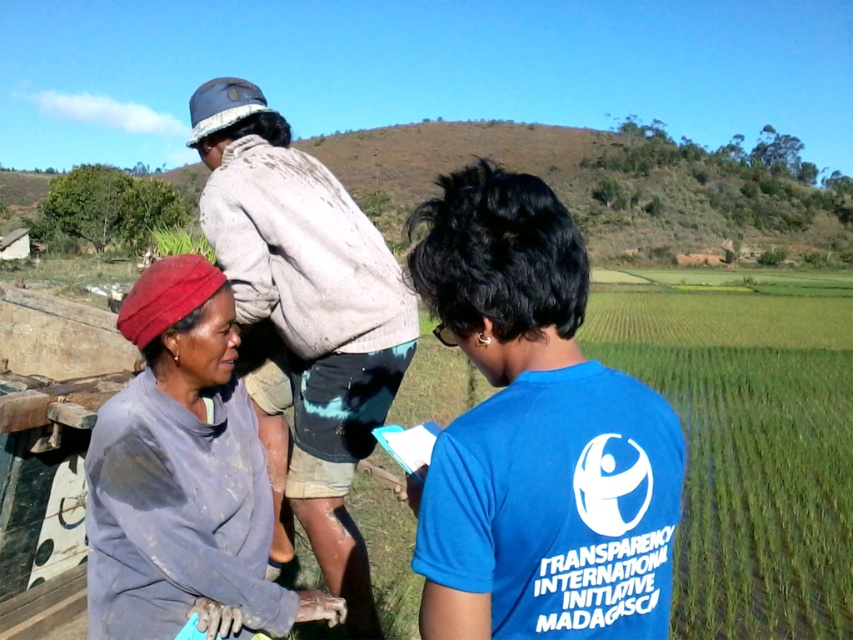
You are standing at the center of the image and want to hand a tool to the person wearing the blue cotton shirt at center. In which direction should you move to approach them?

The blue cotton shirt at center is located at point (537,435), so you should move towards the lower right direction to reach them.

Based on the photo, you are a photographer trying to capture a group photo of the two people wearing the blue cotton shirt at center and the muddy gray shirt at upper center. Since you want to ensure both are in the frame, which one should you position lower in your camera viewfinder to include both?

The blue cotton shirt at center is positioned below the muddy gray shirt at upper center, so to include both in the frame, you should position the blue cotton shirt at center lower in the viewfinder while ensuring the muddy gray shirt at upper center is higher up.